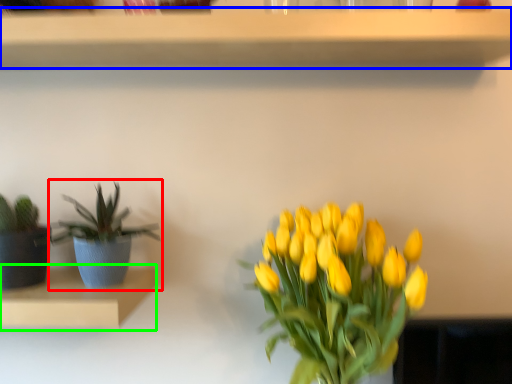
Question: Which object is positioned farthest from houseplant (highlighted by a red box)? Select from shelf (highlighted by a blue box) and shelf (highlighted by a green box).

Choices:
 (A) shelf
 (B) shelf

Answer: (A)